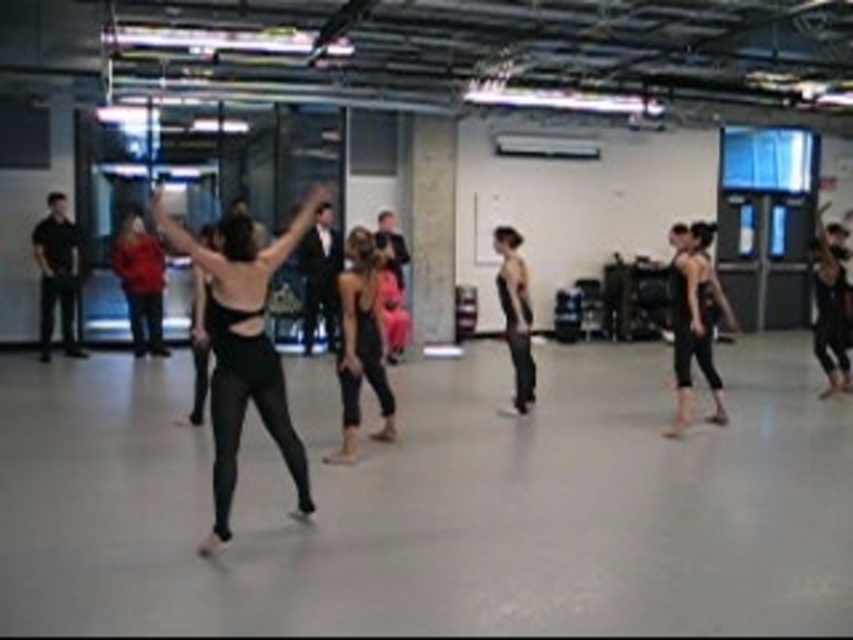
You are a photographer setting up a shoot in the dance studio. You need to position a light source so it illuminates both the black matte leggings at center and the matte black tank top at center without casting harsh shadows. Considering their heights, which object should be placed closer to the light source?

The black matte leggings at center is much taller than the matte black tank top at center, so the matte black tank top at center should be placed closer to the light source to ensure even illumination and avoid harsh shadows.

You are a dancer in the studio and you need to move from your current position to the front of the room. There are two points marked in the studio floor at coordinates point (222, 412) and point (389, 416). Which point should you move towards to get closer to the front of the room?

Point (222, 412) is in front of point (389, 416), so you should move towards point (222, 412) to get closer to the front of the room.

You are a photographer setting up a shoot in the dance studio. You need to focus on the dancer wearing the black matte leggings at center and the matte black tank top at center. Which piece of clothing is positioned higher on the dancer?

The black matte leggings at center is located above the matte black tank top at center, so the leggings are positioned higher on the dancer.